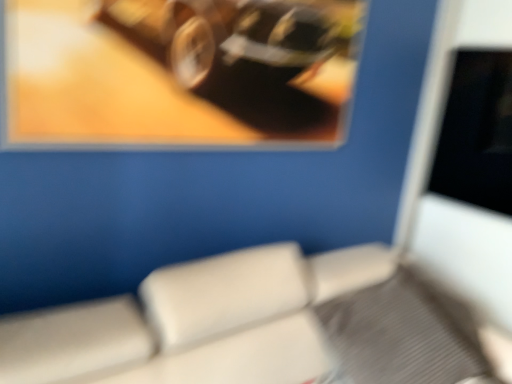
Where is `beige leather chair at lower center`? The image size is (512, 384). beige leather chair at lower center is located at coordinates (196, 322).

What do you see at coordinates (196, 322) in the screenshot?
I see `beige leather chair at lower center` at bounding box center [196, 322].

This screenshot has height=384, width=512. Find the location of `metallic reflective frame at upper left`. metallic reflective frame at upper left is located at coordinates (180, 71).

Describe the element at coordinates (180, 71) in the screenshot. I see `metallic reflective frame at upper left` at that location.

The image size is (512, 384). In order to click on beige leather chair at lower center in this screenshot , I will do `click(196, 322)`.

Considering the relative positions of beige leather chair at lower center and metallic reflective frame at upper left in the image provided, is beige leather chair at lower center to the right of metallic reflective frame at upper left from the viewer's perspective?

Correct, you'll find beige leather chair at lower center to the right of metallic reflective frame at upper left.

Considering the relative positions of beige leather chair at lower center and metallic reflective frame at upper left in the image provided, is beige leather chair at lower center in front of metallic reflective frame at upper left?

Yes, beige leather chair at lower center is closer to the viewer.

Is point (331, 253) behind point (130, 108)?

That is True.

From the image's perspective, is beige leather chair at lower center above metallic reflective frame at upper left?

No.

From a real-world perspective, is beige leather chair at lower center positioned under metallic reflective frame at upper left based on gravity?

Yes, from a real-world perspective, beige leather chair at lower center is below metallic reflective frame at upper left.

Is beige leather chair at lower center wider than metallic reflective frame at upper left?

Indeed, beige leather chair at lower center has a greater width compared to metallic reflective frame at upper left.

Is beige leather chair at lower center taller than metallic reflective frame at upper left?

In fact, beige leather chair at lower center may be shorter than metallic reflective frame at upper left.

Considering the sizes of objects beige leather chair at lower center and metallic reflective frame at upper left in the image provided, who is smaller, beige leather chair at lower center or metallic reflective frame at upper left?

Smaller between the two is metallic reflective frame at upper left.

Can we say beige leather chair at lower center lies outside metallic reflective frame at upper left?

That's correct, beige leather chair at lower center is outside of metallic reflective frame at upper left.

Is beige leather chair at lower center touching metallic reflective frame at upper left?

There is a gap between beige leather chair at lower center and metallic reflective frame at upper left.

Looking at this image, is beige leather chair at lower center facing away from metallic reflective frame at upper left?

beige leather chair at lower center is not turned away from metallic reflective frame at upper left.

How distant is beige leather chair at lower center from metallic reflective frame at upper left?

A distance of 25.21 inches exists between beige leather chair at lower center and metallic reflective frame at upper left.

This screenshot has width=512, height=384. What are the coordinates of `picture frame above the beige leather chair at lower center (from a real-world perspective)` in the screenshot? It's located at (180, 71).

From the picture: Between metallic reflective frame at upper left and beige leather chair at lower center, which one appears on the left side from the viewer's perspective?

From the viewer's perspective, metallic reflective frame at upper left appears more on the left side.

Which object is closer to the camera taking this photo, metallic reflective frame at upper left or beige leather chair at lower center?

beige leather chair at lower center is closer to the camera.

Considering the positions of points (214, 104) and (203, 287), is point (214, 104) closer to camera compared to point (203, 287)?

No, (214, 104) is behind (203, 287).

From the image's perspective, which object appears higher, metallic reflective frame at upper left or beige leather chair at lower center?

metallic reflective frame at upper left appears higher in the image.

From a real-world perspective, is metallic reflective frame at upper left physically above beige leather chair at lower center?

Yes, from a real-world perspective, metallic reflective frame at upper left is on top of beige leather chair at lower center.

Looking at their sizes, would you say metallic reflective frame at upper left is wider or thinner than beige leather chair at lower center?

In the image, metallic reflective frame at upper left appears to be more narrow than beige leather chair at lower center.

Is metallic reflective frame at upper left shorter than beige leather chair at lower center?

No, metallic reflective frame at upper left is not shorter than beige leather chair at lower center.

Based on their sizes in the image, would you say metallic reflective frame at upper left is bigger or smaller than beige leather chair at lower center?

Clearly, metallic reflective frame at upper left is smaller in size than beige leather chair at lower center.

Is metallic reflective frame at upper left located outside beige leather chair at lower center?

Indeed, metallic reflective frame at upper left is completely outside beige leather chair at lower center.

Is metallic reflective frame at upper left directly adjacent to beige leather chair at lower center?

No, metallic reflective frame at upper left is not making contact with beige leather chair at lower center.

Is metallic reflective frame at upper left looking in the opposite direction of beige leather chair at lower center?

No, metallic reflective frame at upper left is not facing away from beige leather chair at lower center.

What's the angular difference between metallic reflective frame at upper left and beige leather chair at lower center's facing directions?

0.563 degrees separate the facing orientations of metallic reflective frame at upper left and beige leather chair at lower center.

At what (x,y) coordinates should I click in order to perform the action: click on picture frame above the beige leather chair at lower center (from the image's perspective). Please return your answer as a coordinate pair (x, y). This screenshot has width=512, height=384. Looking at the image, I should click on (180, 71).

Locate an element on the screen. This screenshot has height=384, width=512. picture frame on the left of beige leather chair at lower center is located at coordinates (180, 71).

Where is `furniture below the metallic reflective frame at upper left (from a real-world perspective)`? The height and width of the screenshot is (384, 512). furniture below the metallic reflective frame at upper left (from a real-world perspective) is located at coordinates (196, 322).